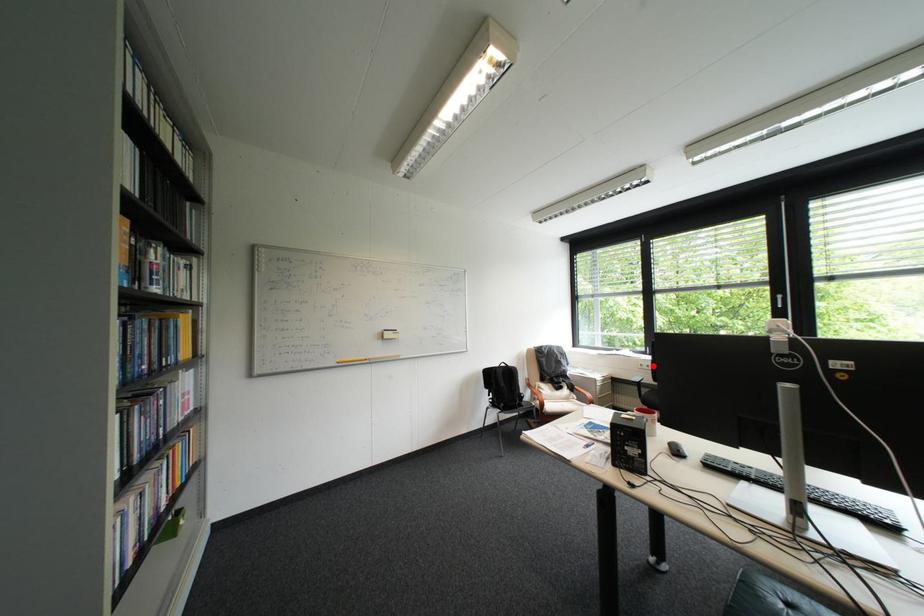
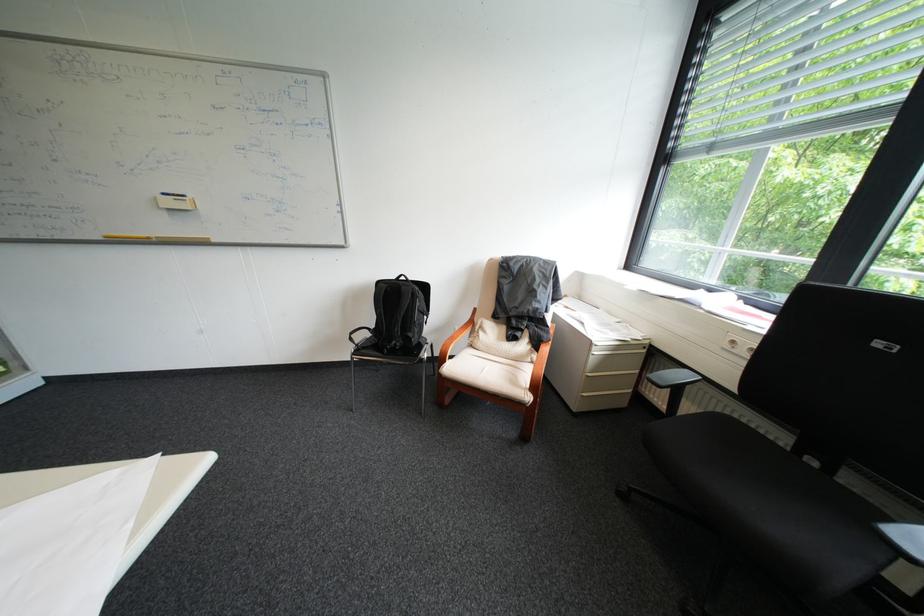
Question: I am providing you with two images of the same scene from different viewpoints. Given a red point in image1, look at the same physical point in image2. Is it:

Choices:
 (A) Closer to the viewpoint
 (B) Farther from the viewpoint

Answer: (A)